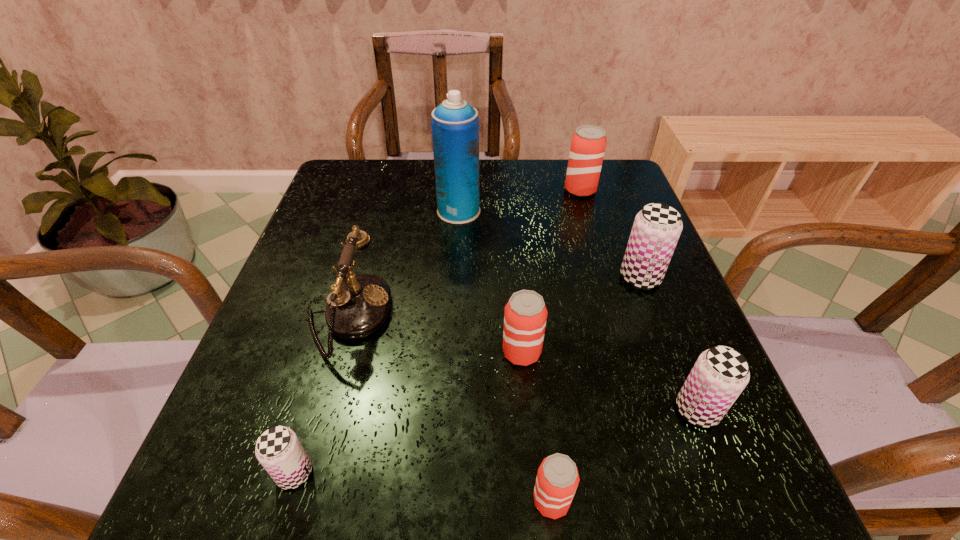
Where is `blank space that satisfies the following two spatial constraints: 1. on the dial of the telephone; 2. on the right side of the nearest orange beer can`? This screenshot has height=540, width=960. blank space that satisfies the following two spatial constraints: 1. on the dial of the telephone; 2. on the right side of the nearest orange beer can is located at coordinates (296, 501).

Identify the location of vacant space that satisfies the following two spatial constraints: 1. on the dial of the sixth farthest object; 2. on the left side of the telephone. (322, 410).

The image size is (960, 540). I want to click on vacant space that satisfies the following two spatial constraints: 1. on the front side of the tallest object; 2. on the right side of the second nearest purple beer can, so click(447, 410).

Locate an element on the screen. vacant space that satisfies the following two spatial constraints: 1. on the back side of the biggest purple beer can; 2. on the right side of the leftmost purple beer can is located at coordinates (353, 277).

Locate an element on the screen. The width and height of the screenshot is (960, 540). vacant region that satisfies the following two spatial constraints: 1. on the front side of the sixth object from right to left; 2. on the left side of the smallest orange beer can is located at coordinates (442, 501).

The image size is (960, 540). What are the coordinates of `free space that satisfies the following two spatial constraints: 1. on the front side of the sixth farthest object; 2. on the left side of the farthest purple beer can` in the screenshot? It's located at (690, 410).

You are a GUI agent. You are given a task and a screenshot of the screen. Output one action in this format:
    pyautogui.click(x=<x>, y=<y>)
    Task: Click on the vacant point that satisfies the following two spatial constraints: 1. on the dial of the black telephone; 2. on the left side of the second biggest purple beer can
    
    Given the screenshot: What is the action you would take?
    pyautogui.click(x=322, y=410)